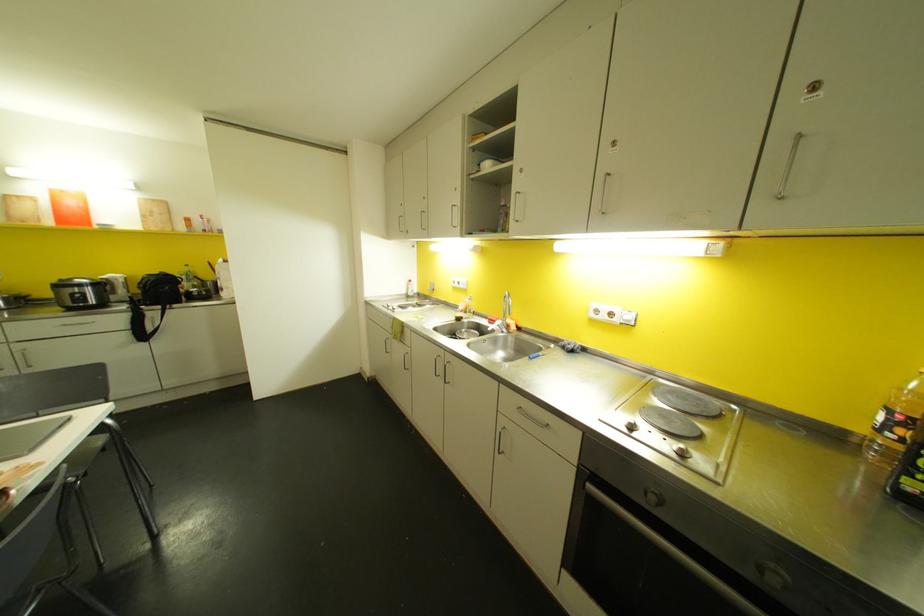
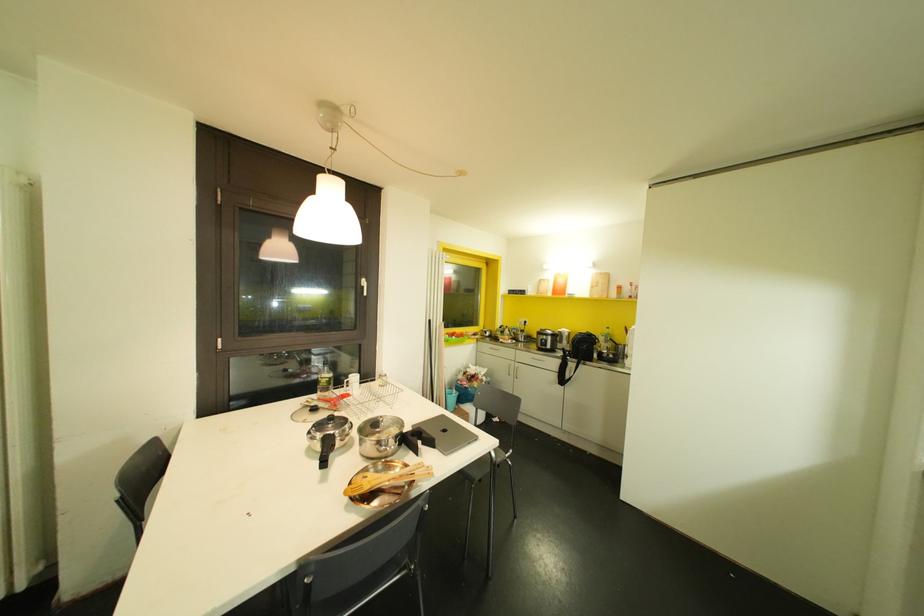
Question: How did the camera likely rotate?

Choices:
 (A) Left
 (B) Right
 (C) Up
 (D) Down

Answer: (A)